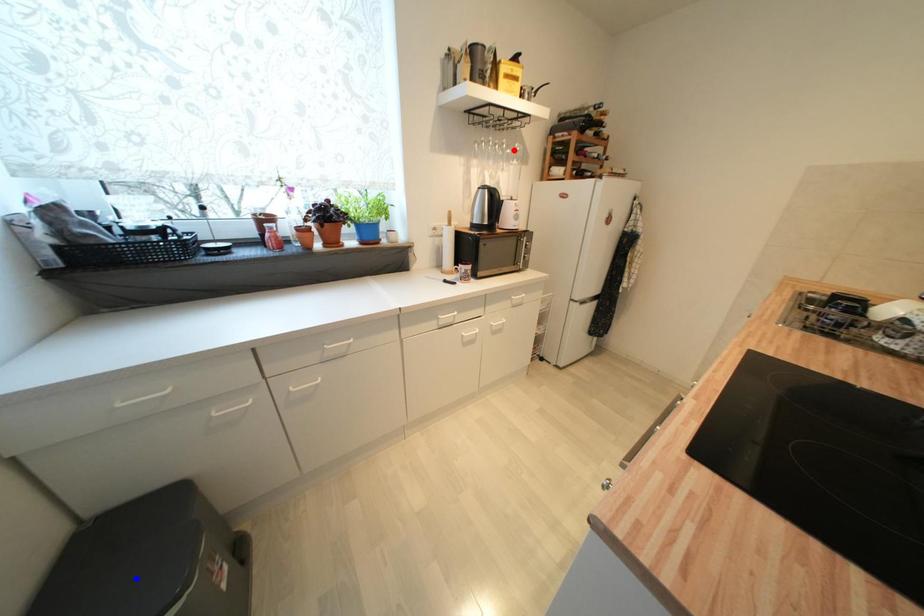
Question: In the image, two points are highlighted. Which point is nearer to the camera? Reply with the corresponding letter.

Choices:
 (A) blue point
 (B) red point

Answer: (A)